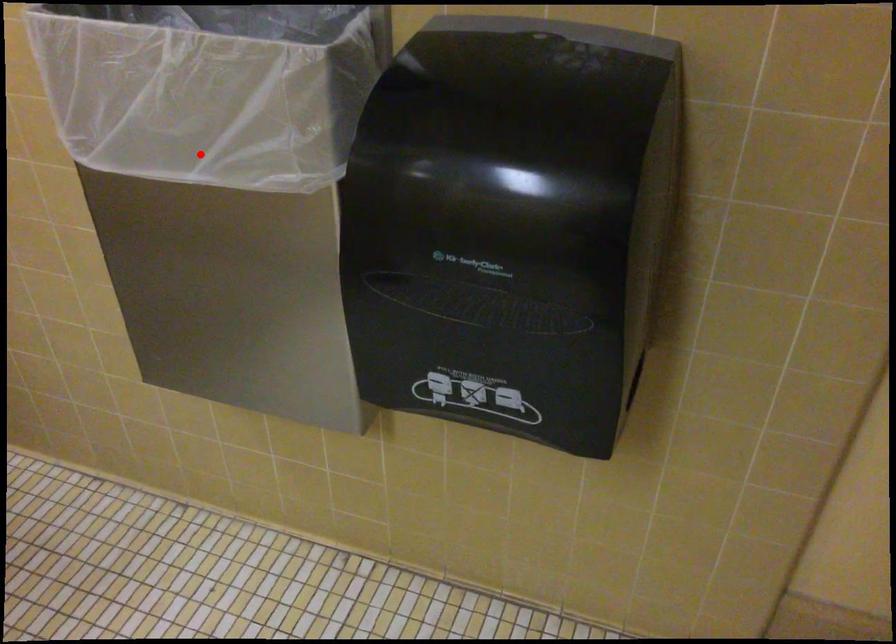
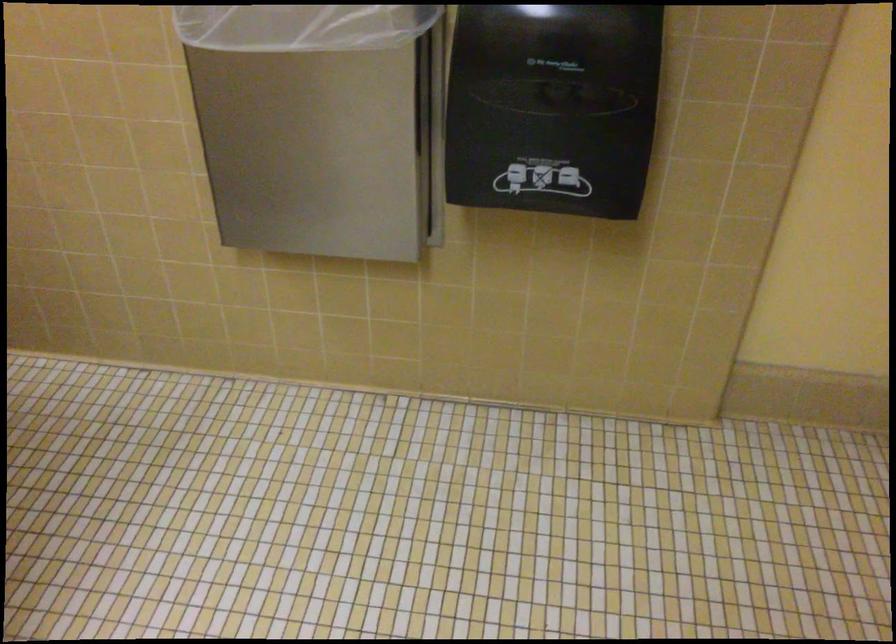
Question: I am providing you with two images of the same scene from different viewpoints. Image1 has a red point marked. In image2, the corresponding 3D location appears at what relative position? Reply with the corresponding letter.

Choices:
 (A) Closer
 (B) Farther

Answer: (B)